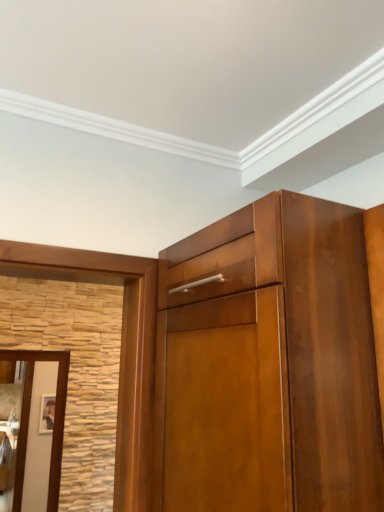
The image size is (384, 512). Identify the location of glossy wood cupboard at upper center. (251, 360).

What do you see at coordinates (251, 360) in the screenshot? The width and height of the screenshot is (384, 512). I see `glossy wood cupboard at upper center` at bounding box center [251, 360].

Image resolution: width=384 pixels, height=512 pixels. Describe the element at coordinates (38, 440) in the screenshot. I see `brown wooden door at left` at that location.

Where is `brown wooden door at left`? brown wooden door at left is located at coordinates (38, 440).

Identify the location of glossy wood cupboard at upper center. Image resolution: width=384 pixels, height=512 pixels. (251, 360).

Between brown wooden door at left and glossy wood cupboard at upper center, which one appears on the left side from the viewer's perspective?

From the viewer's perspective, brown wooden door at left appears more on the left side.

Which object is closer to the camera, brown wooden door at left or glossy wood cupboard at upper center?

glossy wood cupboard at upper center is closer to the camera.

Which is in front, point (34, 478) or point (338, 330)?

The point (338, 330) is closer to the camera.

From the image's perspective, is brown wooden door at left positioned above or below glossy wood cupboard at upper center?

brown wooden door at left is below glossy wood cupboard at upper center.

From a real-world perspective, is brown wooden door at left positioned under glossy wood cupboard at upper center based on gravity?

Yes.

Considering the sizes of brown wooden door at left and glossy wood cupboard at upper center in the image, is brown wooden door at left wider or thinner than glossy wood cupboard at upper center?

Clearly, brown wooden door at left has less width compared to glossy wood cupboard at upper center.

Which of these two, brown wooden door at left or glossy wood cupboard at upper center, stands shorter?

Standing shorter between the two is glossy wood cupboard at upper center.

Which of these two, brown wooden door at left or glossy wood cupboard at upper center, is bigger?

Bigger between the two is glossy wood cupboard at upper center.

Choose the correct answer: Is brown wooden door at left inside glossy wood cupboard at upper center or outside it?

brown wooden door at left is not inside glossy wood cupboard at upper center, it's outside.

Is brown wooden door at left directly adjacent to glossy wood cupboard at upper center?

brown wooden door at left and glossy wood cupboard at upper center are clearly separated.

Does brown wooden door at left turn towards glossy wood cupboard at upper center?

Yes, brown wooden door at left is turned towards glossy wood cupboard at upper center.

How many degrees apart are the facing directions of brown wooden door at left and glossy wood cupboard at upper center?

The angular difference between brown wooden door at left and glossy wood cupboard at upper center is 88.1 degrees.

Where is `cupboard lying on the right of brown wooden door at left`? cupboard lying on the right of brown wooden door at left is located at coordinates (251, 360).

Which object is positioned more to the right, glossy wood cupboard at upper center or brown wooden door at left?

glossy wood cupboard at upper center.

Between glossy wood cupboard at upper center and brown wooden door at left, which one is positioned in front?

glossy wood cupboard at upper center is in front.

Is point (364, 342) closer or farther from the camera than point (27, 442)?

Clearly, point (364, 342) is closer to the camera than point (27, 442).

From the image's perspective, who appears lower, glossy wood cupboard at upper center or brown wooden door at left?

From the image's view, brown wooden door at left is below.

From a real-world perspective, relative to brown wooden door at left, is glossy wood cupboard at upper center vertically above or below?

Clearly, from a real-world perspective, glossy wood cupboard at upper center is above brown wooden door at left.

Considering the sizes of objects glossy wood cupboard at upper center and brown wooden door at left in the image provided, who is thinner, glossy wood cupboard at upper center or brown wooden door at left?

With smaller width is brown wooden door at left.

Can you confirm if glossy wood cupboard at upper center is taller than brown wooden door at left?

No, glossy wood cupboard at upper center is not taller than brown wooden door at left.

Which of these two, glossy wood cupboard at upper center or brown wooden door at left, is bigger?

glossy wood cupboard at upper center.

Is brown wooden door at left completely or partially inside glossy wood cupboard at upper center?

No, brown wooden door at left is located outside of glossy wood cupboard at upper center.

Is glossy wood cupboard at upper center far from brown wooden door at left?

That's right, there is a large distance between glossy wood cupboard at upper center and brown wooden door at left.

Is glossy wood cupboard at upper center looking in the opposite direction of brown wooden door at left?

glossy wood cupboard at upper center is not turned away from brown wooden door at left.

Can you tell me how much glossy wood cupboard at upper center and brown wooden door at left differ in facing direction?

glossy wood cupboard at upper center and brown wooden door at left are facing 88.1 degrees away from each other.

Where is `door that appears below the glossy wood cupboard at upper center (from the image's perspective)`? The height and width of the screenshot is (512, 384). door that appears below the glossy wood cupboard at upper center (from the image's perspective) is located at coordinates (38, 440).

Locate an element on the screen. This screenshot has height=512, width=384. door located behind the glossy wood cupboard at upper center is located at coordinates pyautogui.click(x=38, y=440).

Identify the location of cupboard in front of the brown wooden door at left. (251, 360).